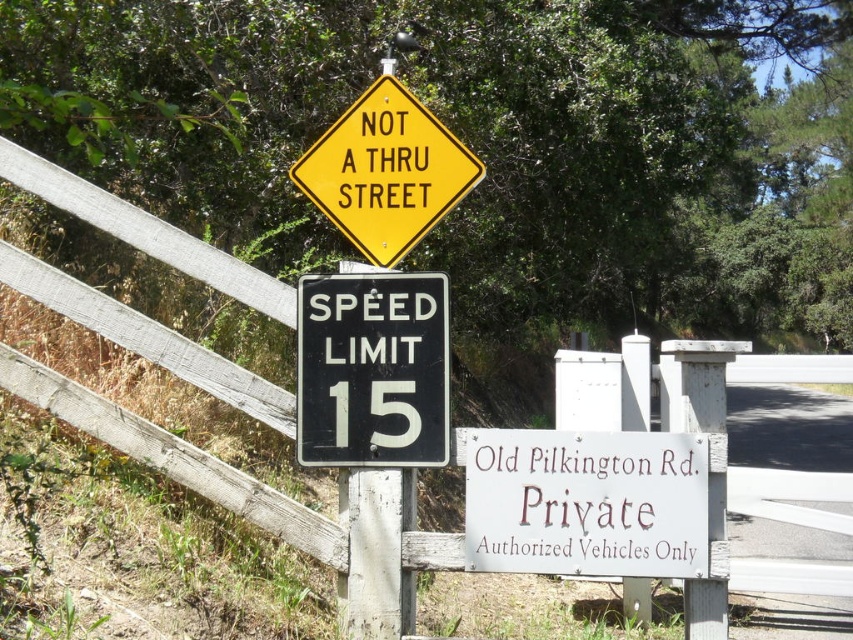
You are a delivery driver approaching the white painted wood sign at lower center and camera. The delivery truck is 12 feet long. Can the truck safely turn around without hitting any obstacles?

The distance between the white painted wood sign at lower center and the camera is 13.34 feet. Since the truck is 12 feet long, there is enough space for it to turn around safely without hitting any obstacles.

You are a delivery driver approaching the wooden post with several signs. You need to determine the location of the white painted wood sign at lower center. What are its coordinates?

The white painted wood sign at lower center is located at coordinates point (585, 502).